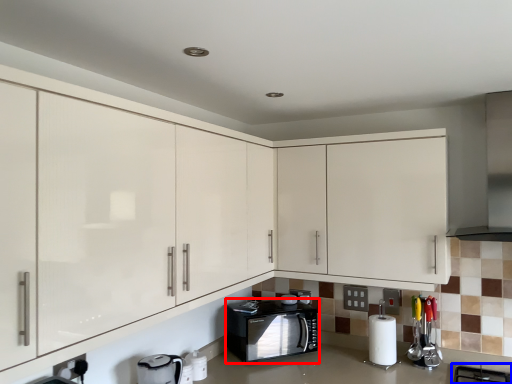
Question: Which object is further to the camera taking this photo, home appliance (highlighted by a red box) or gas stove (highlighted by a blue box)?

Choices:
 (A) home appliance
 (B) gas stove

Answer: (A)